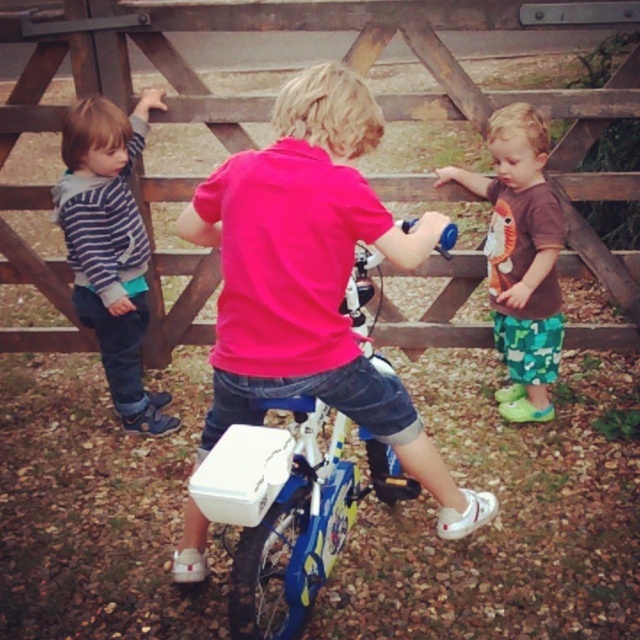
Question: Which of the following is the farthest from the observer?

Choices:
 (A) pink matte shirt at center
 (B) striped hoodie at left
 (C) brown cotton shirt at right
 (D) blue metallic bicycle at center

Answer: (C)

Question: Which point appears farthest from the camera in this image?

Choices:
 (A) (70, 337)
 (B) (337, 134)
 (C) (340, 435)

Answer: (A)

Question: Which of the following is the closest to the observer?

Choices:
 (A) striped hoodie at left
 (B) pink matte shirt at center

Answer: (B)

Question: Is wooden fence at center positioned before blue metallic bicycle at center?

Choices:
 (A) yes
 (B) no

Answer: (B)

Question: Where is blue metallic bicycle at center located in relation to striped hoodie at left in the image?

Choices:
 (A) below
 (B) above

Answer: (A)

Question: Is blue metallic bicycle at center to the right of striped hoodie at left from the viewer's perspective?

Choices:
 (A) no
 (B) yes

Answer: (B)